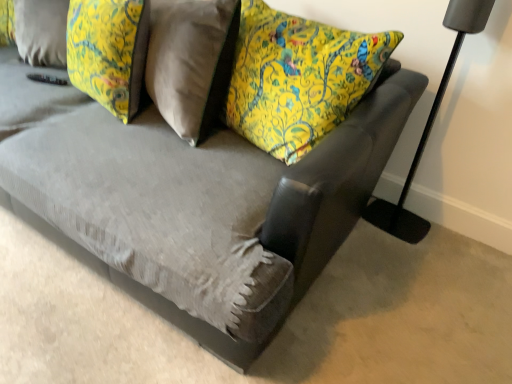
Question: Considering the positions of matte black floor lamp at right and yellow floral fabric pillow at upper left in the image, is matte black floor lamp at right wider or thinner than yellow floral fabric pillow at upper left?

Choices:
 (A) wide
 (B) thin

Answer: (B)

Question: Considering the positions of matte black floor lamp at right and yellow floral fabric pillow at upper left in the image, is matte black floor lamp at right taller or shorter than yellow floral fabric pillow at upper left?

Choices:
 (A) short
 (B) tall

Answer: (B)

Question: Choose the correct answer: Is matte black floor lamp at right inside yellow floral fabric pillow at upper left or outside it?

Choices:
 (A) outside
 (B) inside

Answer: (A)

Question: In the image, is yellow floral fabric pillow at upper left positioned in front of or behind matte black floor lamp at right?

Choices:
 (A) front
 (B) behind

Answer: (B)

Question: Is yellow floral fabric pillow at upper left wider or thinner than matte black floor lamp at right?

Choices:
 (A) thin
 (B) wide

Answer: (B)

Question: From the image's perspective, relative to matte black floor lamp at right, is yellow floral fabric pillow at upper left above or below?

Choices:
 (A) above
 (B) below

Answer: (A)

Question: Looking at the image, does yellow floral fabric pillow at upper left seem bigger or smaller compared to matte black floor lamp at right?

Choices:
 (A) big
 (B) small

Answer: (A)